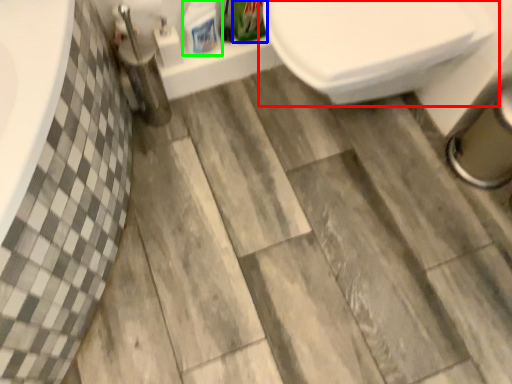
Question: Which object is the farthest from toilet (highlighted by a red box)? Choose among these: cleaning product (highlighted by a blue box) or cleaning product (highlighted by a green box).

Choices:
 (A) cleaning product
 (B) cleaning product

Answer: (B)